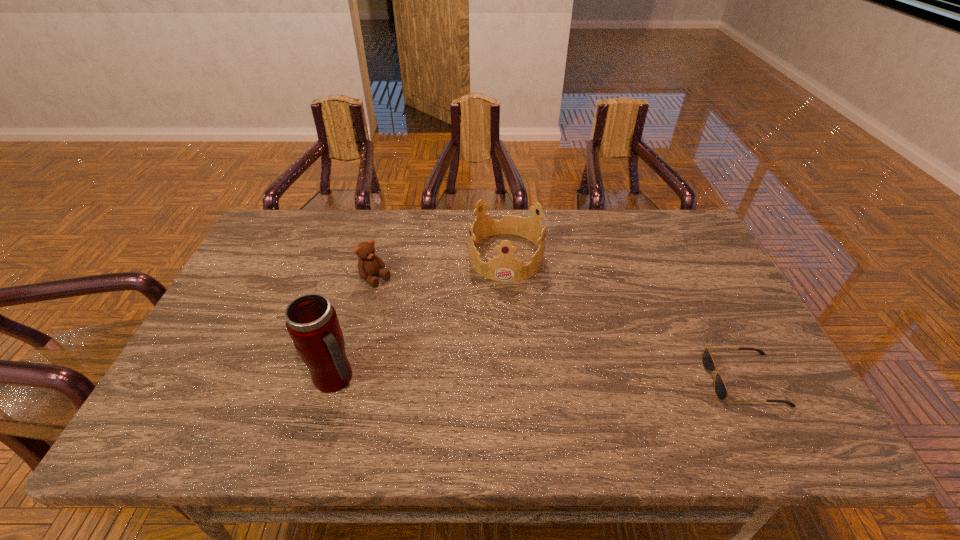
Locate an element on the screen. thermos bottle is located at coordinates (312, 323).

The width and height of the screenshot is (960, 540). I want to click on the rightmost object, so click(x=708, y=363).

Image resolution: width=960 pixels, height=540 pixels. What are the coordinates of `sunglasses` in the screenshot? It's located at (708, 363).

The height and width of the screenshot is (540, 960). I want to click on the third tallest object, so click(369, 264).

You are a GUI agent. You are given a task and a screenshot of the screen. Output one action in this format:
    pyautogui.click(x=<x>, y=<y>)
    Task: Click on the second tallest object
    The height and width of the screenshot is (540, 960).
    Given the screenshot: What is the action you would take?
    pyautogui.click(x=504, y=268)

Identify the location of the third object from left to right. (504, 268).

Where is `free space located on the side with the handle of the thermos bottle`? The image size is (960, 540). free space located on the side with the handle of the thermos bottle is located at coordinates (482, 379).

Where is `vacant area situated 0.230m on the front-facing side of the shortest object`? The image size is (960, 540). vacant area situated 0.230m on the front-facing side of the shortest object is located at coordinates (612, 380).

This screenshot has width=960, height=540. What are the coordinates of `free space located on the front-facing side of the shortest object` in the screenshot? It's located at (666, 380).

Image resolution: width=960 pixels, height=540 pixels. What are the coordinates of `vacant point located on the front-facing side of the shortest object` in the screenshot? It's located at (577, 380).